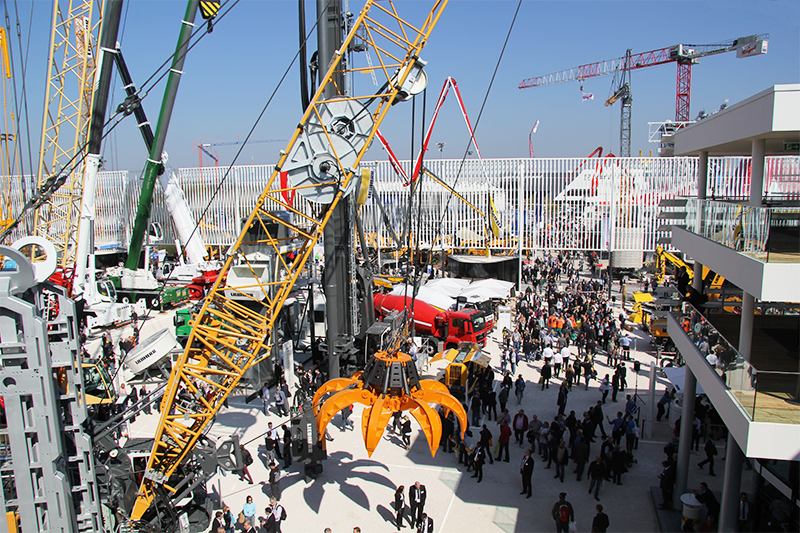
Where is `flower shaped shadow`? The image size is (800, 533). flower shaped shadow is located at coordinates (332, 471).